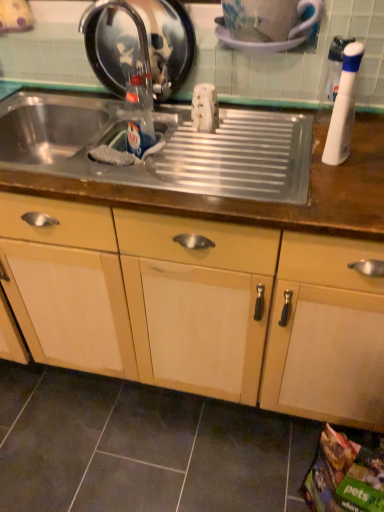
Where is `vacant space situated on the left part of white plastic bottle at right, placed as the 2th bottle when sorted from left to right`? The image size is (384, 512). vacant space situated on the left part of white plastic bottle at right, placed as the 2th bottle when sorted from left to right is located at coordinates (266, 160).